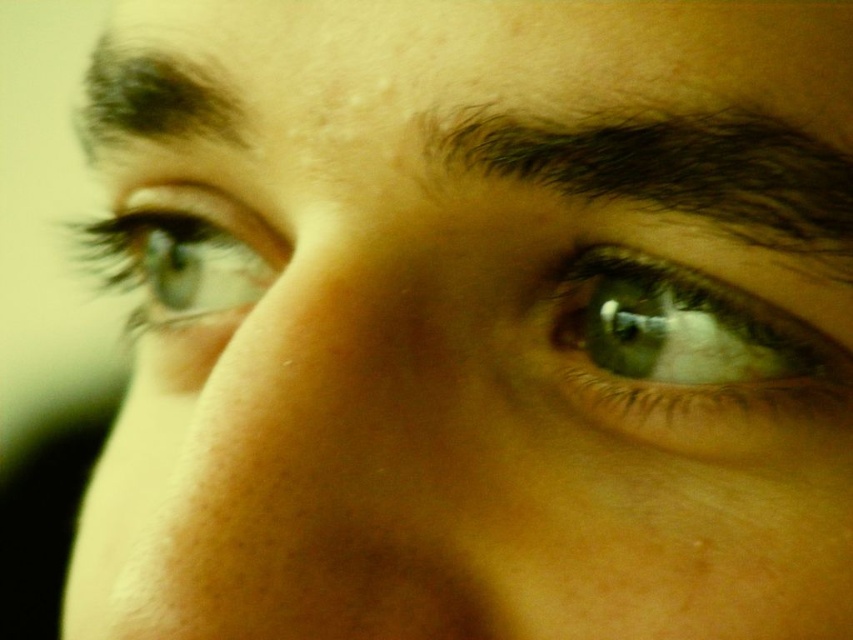
Does point (799, 353) lie behind point (813, 160)?

That is True.

Based on the photo, does green matte eye at center have a greater height compared to dark brown hair at upper center?

Yes, green matte eye at center is taller than dark brown hair at upper center.

This screenshot has height=640, width=853. Identify the location of green matte eye at center. (683, 356).

Which is above, dark brown hair at upper center or dark brown hair at upper left?

dark brown hair at upper left is above.

Can you confirm if dark brown hair at upper center is shorter than dark brown hair at upper left?

Indeed, dark brown hair at upper center has a lesser height compared to dark brown hair at upper left.

Which is behind, point (744, 170) or point (103, 120)?

Point (103, 120)

In order to click on dark brown hair at upper center in this screenshot , I will do `click(682, 170)`.

Is point (843, 161) closer to viewer compared to point (256, 218)?

Yes.

Can you confirm if dark brown hair at upper center is positioned to the left of green matte eye at upper left?

No, dark brown hair at upper center is not to the left of green matte eye at upper left.

Who is more forward, [773,132] or [262,260]?

Point [773,132]

You are a GUI agent. You are given a task and a screenshot of the screen. Output one action in this format:
    pyautogui.click(x=<x>, y=<y>)
    Task: Click on the dark brown hair at upper center
    
    Given the screenshot: What is the action you would take?
    pyautogui.click(x=682, y=170)